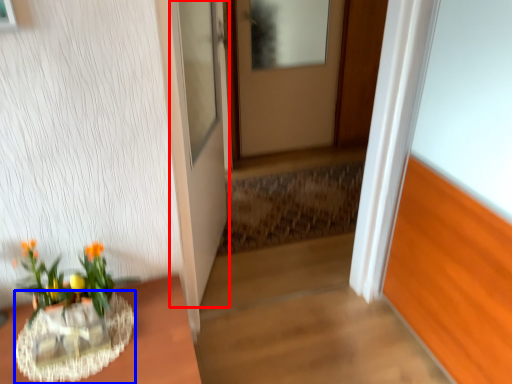
Question: Among these objects, which one is nearest to the camera, door (highlighted by a red box) or vase (highlighted by a blue box)?

Choices:
 (A) door
 (B) vase

Answer: (B)